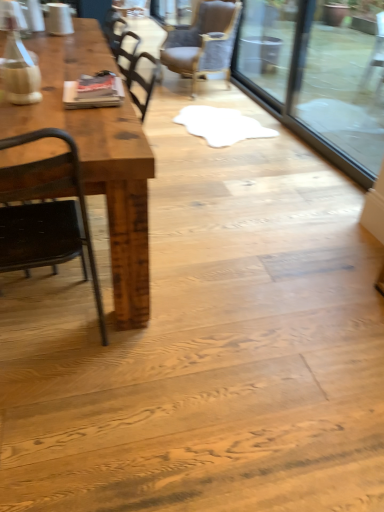
Question: From the image's perspective, would you say transparent glass door at upper right is shown under rustic wood table at left?

Choices:
 (A) yes
 (B) no

Answer: (B)

Question: Would you say transparent glass door at upper right is outside rustic wood table at left?

Choices:
 (A) no
 (B) yes

Answer: (B)

Question: Is transparent glass door at upper right at the right side of rustic wood table at left?

Choices:
 (A) yes
 (B) no

Answer: (A)

Question: Can you confirm if transparent glass door at upper right is wider than rustic wood table at left?

Choices:
 (A) yes
 (B) no

Answer: (B)

Question: Can you confirm if transparent glass door at upper right is positioned to the left of rustic wood table at left?

Choices:
 (A) no
 (B) yes

Answer: (A)

Question: From the image's perspective, is black metal chair at left, the 2th chair from the top, located above or below rustic wood table at left?

Choices:
 (A) above
 (B) below

Answer: (B)

Question: Looking at their shapes, would you say black metal chair at left, the 1th chair viewed from the left, is wider or thinner than rustic wood table at left?

Choices:
 (A) thin
 (B) wide

Answer: (A)

Question: Would you say black metal chair at left, the first chair when ordered from front to back, is inside or outside rustic wood table at left?

Choices:
 (A) inside
 (B) outside

Answer: (A)

Question: In terms of height, does black metal chair at left, the 2th chair from the top, look taller or shorter compared to rustic wood table at left?

Choices:
 (A) short
 (B) tall

Answer: (B)

Question: Is brown leather chair at upper center, positioned as the 1th chair in right-to-left order, wider or thinner than black metal chair at left, the second chair viewed from the back?

Choices:
 (A) thin
 (B) wide

Answer: (B)

Question: From the image's perspective, is brown leather chair at upper center, acting as the second chair starting from the front, positioned above or below black metal chair at left, the 2th chair from the top?

Choices:
 (A) below
 (B) above

Answer: (B)

Question: Based on their positions, is brown leather chair at upper center, arranged as the 1th chair when viewed from the back, located to the left or right of black metal chair at left, the first chair when ordered from front to back?

Choices:
 (A) left
 (B) right

Answer: (B)

Question: From a real-world perspective, relative to black metal chair at left, which ranks as the 2th chair in right-to-left order, is brown leather chair at upper center, acting as the 1th chair starting from the top, vertically above or below?

Choices:
 (A) above
 (B) below

Answer: (B)

Question: From the image's perspective, is rustic wood table at left located above or below brown leather chair at upper center, positioned as the 1th chair in right-to-left order?

Choices:
 (A) above
 (B) below

Answer: (B)

Question: In the image, is rustic wood table at left positioned in front of or behind brown leather chair at upper center, acting as the second chair starting from the front?

Choices:
 (A) front
 (B) behind

Answer: (A)